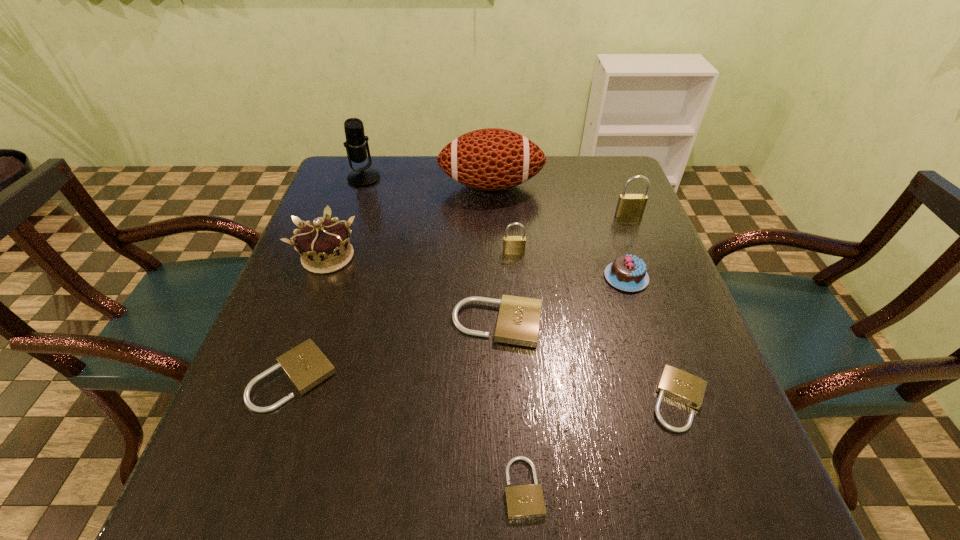
In order to click on microphone that is at the left edge in this screenshot , I will do `click(356, 143)`.

Find the location of `crown positioned at the left edge`. crown positioned at the left edge is located at coordinates (324, 246).

Locate an element on the screen. padlock at the left edge is located at coordinates (306, 366).

You are a GUI agent. You are given a task and a screenshot of the screen. Output one action in this format:
    pyautogui.click(x=<x>, y=<y>)
    Task: Click on the chocolate cake present at the right edge
    The image size is (960, 540).
    Given the screenshot: What is the action you would take?
    pyautogui.click(x=628, y=273)

I want to click on object present at the far left corner, so click(356, 143).

Locate an element on the screen. The width and height of the screenshot is (960, 540). free space at the far edge is located at coordinates (550, 194).

I want to click on vacant area at the left edge, so click(314, 212).

Where is `free space at the right edge`? The height and width of the screenshot is (540, 960). free space at the right edge is located at coordinates (707, 443).

In the image, there is a desktop. At what (x,y) coordinates should I click in order to perform the action: click on blank space at the far left corner. Please return your answer as a coordinate pair (x, y). This screenshot has width=960, height=540. Looking at the image, I should click on (383, 181).

What are the coordinates of `vacant space at the far right corner of the desktop` in the screenshot? It's located at (572, 171).